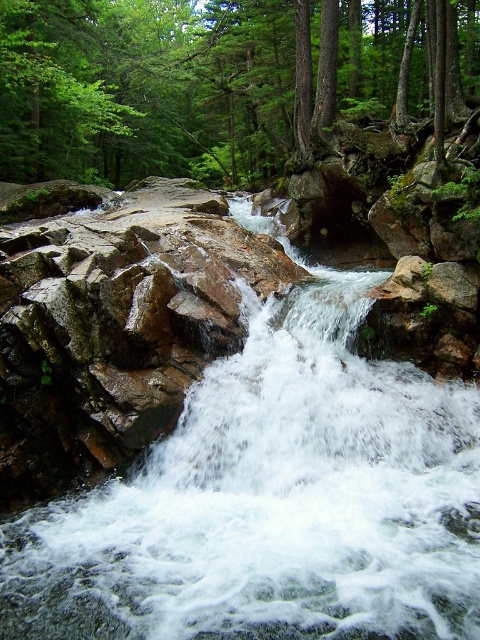
You are a hiker standing at the edge of the forest near the waterfall. You see the white frothy water at center and the green matte tree at center. Which object is located to the right of the other?

The white frothy water at center is positioned to the right of the green matte tree at center.

You are a hiker standing at the edge of the forest. You see the white frothy water at center and the green matte tree at center. Which one is farther from you?

The white frothy water at center is 84.42 feet away from the green matte tree at center. Since the distance between them is given, but the question asks which is farther from you, the hiker at the edge of the forest, we need to determine their relative positions. However, without knowing the exact position of the hiker relative to both objects, we cannot definitively say which is farther. The description only provides the distance between the two objects, not their individual distances from the observer.